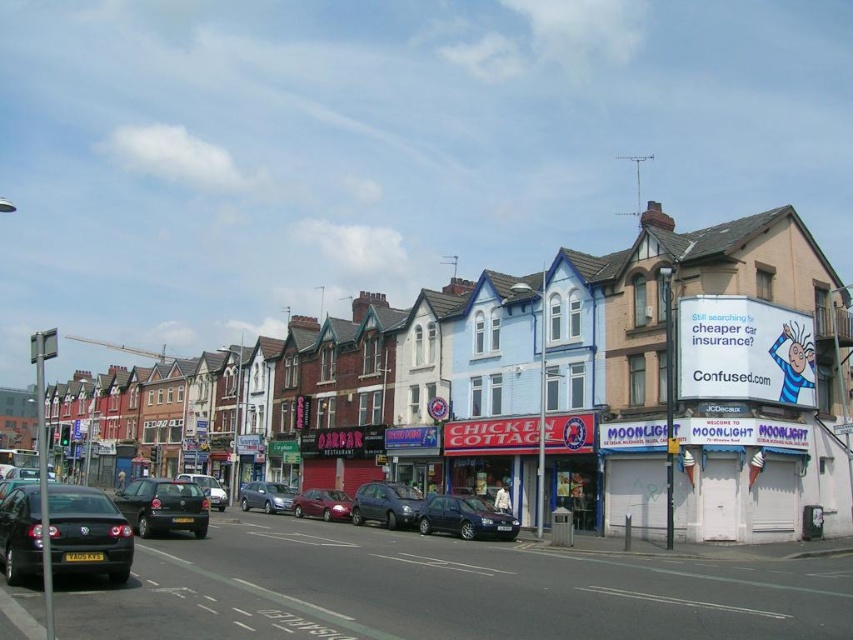
Identify the location of silver metallic sedan at center. The width and height of the screenshot is (853, 640). (265, 497).

Is silver metallic sedan at center shorter than shiny silver sedan at center?

Yes.

Which is in front, point (263, 500) or point (178, 474)?

Positioned in front is point (263, 500).

Where is `silver metallic sedan at center`? This screenshot has height=640, width=853. silver metallic sedan at center is located at coordinates (265, 497).

The height and width of the screenshot is (640, 853). I want to click on matte black car at left, so click(538, 388).

This screenshot has width=853, height=640. What do you see at coordinates (538, 388) in the screenshot? I see `matte black car at left` at bounding box center [538, 388].

At what (x,y) coordinates should I click in order to perform the action: click on matte black car at left. Please return your answer as a coordinate pair (x, y). Image resolution: width=853 pixels, height=640 pixels. Looking at the image, I should click on (538, 388).

Can you confirm if matte black car at center is wider than silver metallic sedan at center?

Yes, matte black car at center is wider than silver metallic sedan at center.

Is matte black car at center in front of silver metallic sedan at center?

Yes, matte black car at center is closer to the viewer.

Is point (190, 492) farther from viewer compared to point (287, 486)?

No, it is in front of (287, 486).

You are a GUI agent. You are given a task and a screenshot of the screen. Output one action in this format:
    pyautogui.click(x=<x>, y=<y>)
    Task: Click on the matte black car at center
    This screenshot has width=853, height=640.
    Given the screenshot: What is the action you would take?
    pyautogui.click(x=163, y=506)